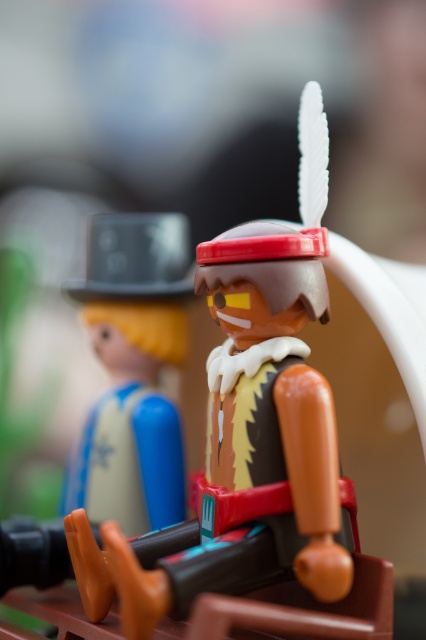
Question: Can you confirm if matte plastic toy at center is positioned below matte black hat at left?

Choices:
 (A) no
 (B) yes

Answer: (A)

Question: Is matte plastic toy at center thinner than matte black hat at left?

Choices:
 (A) yes
 (B) no

Answer: (B)

Question: Which point appears farthest from the camera in this image?

Choices:
 (A) (250, 408)
 (B) (92, 426)

Answer: (B)

Question: Can you confirm if matte plastic toy at center is wider than matte black hat at left?

Choices:
 (A) no
 (B) yes

Answer: (B)

Question: Among these points, which one is farthest from the camera?

Choices:
 (A) (321, 528)
 (B) (134, 468)

Answer: (B)

Question: Which point appears closest to the camera in this image?

Choices:
 (A) (132, 284)
 (B) (218, 598)

Answer: (B)